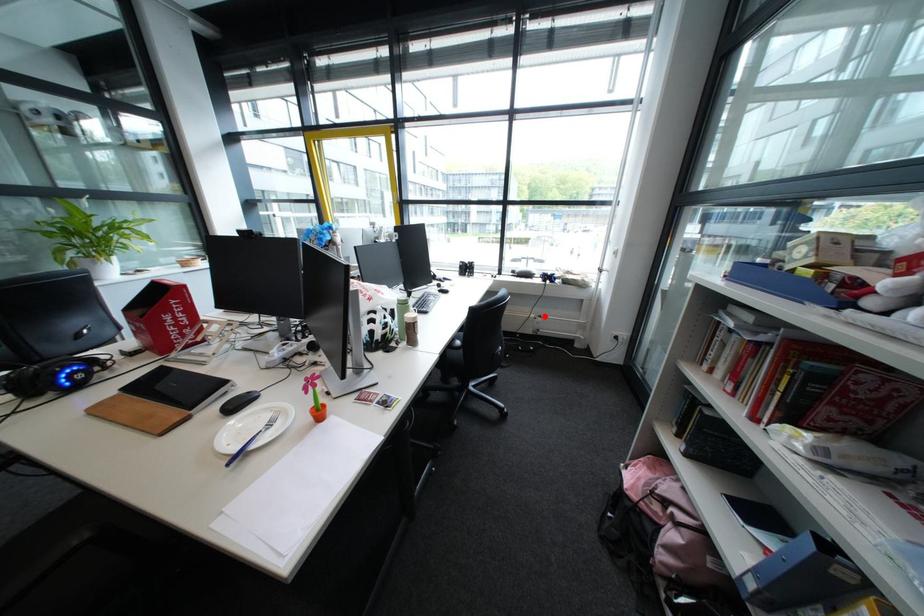
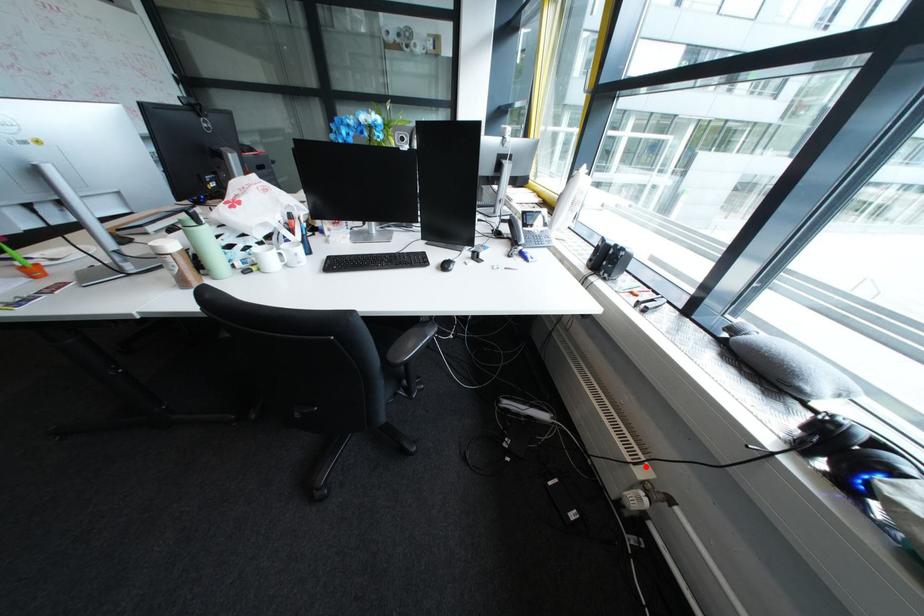
I am providing you with two images of the same scene from different viewpoints. A red point is marked on the first image and another point is marked on the second image. Do the highlighted points in image1 and image2 indicate the same real-world spot?

Yes